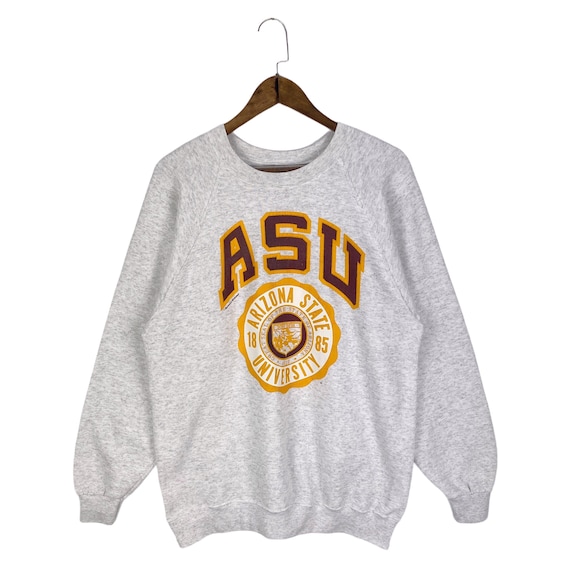
I want to click on metal hanger hook, so click(x=280, y=21).